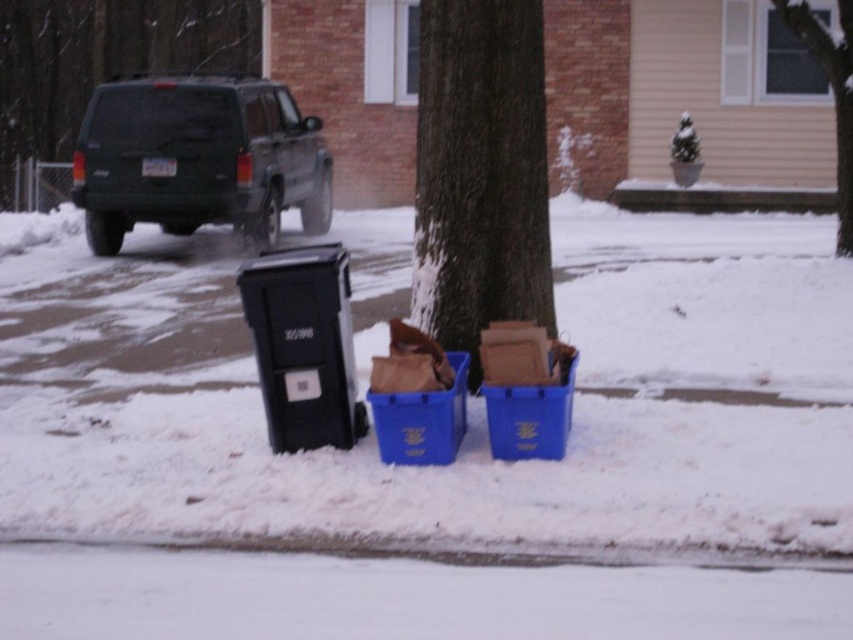
You are a delivery person trying to navigate through the snowy street. There is a black plastic recycling bin at lower left and a smooth bark tree at upper center. Which object is positioned to the left of the other?

The black plastic recycling bin at lower left is to the left of the smooth bark tree at upper center.

You are a delivery person trying to park your delivery van in this snowy street. You see the green matte suv at upper left and the smooth bark tree at upper center. Which object is closer to the left side of the street?

The green matte suv at upper left is positioned on the left side of smooth bark tree at upper center, so it is closer to the left side of the street.

A delivery robot with a width of 1.2 meters needs to navigate between the snowy concrete pavement at lower center and the black plastic recycling bin at lower left. Can it pass through the space between them without touching either?

The distance between the snowy concrete pavement at lower center and the black plastic recycling bin at lower left is 2.86 meters. Since the robot is 1.2 meters wide, there is sufficient space for it to pass through without touching either object.